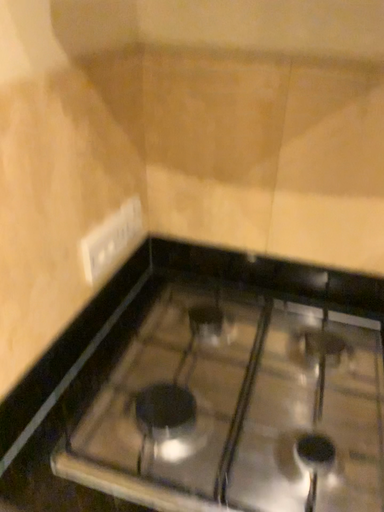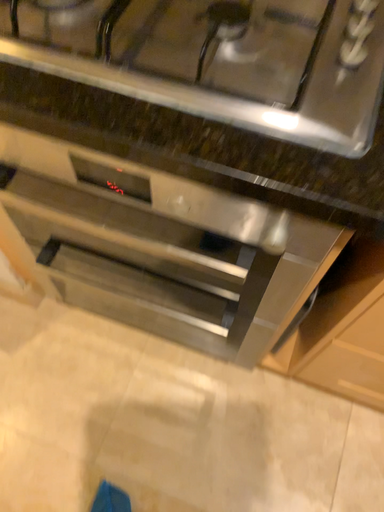
Question: Which way did the camera rotate in the video?

Choices:
 (A) rotated downward
 (B) rotated upward

Answer: (A)